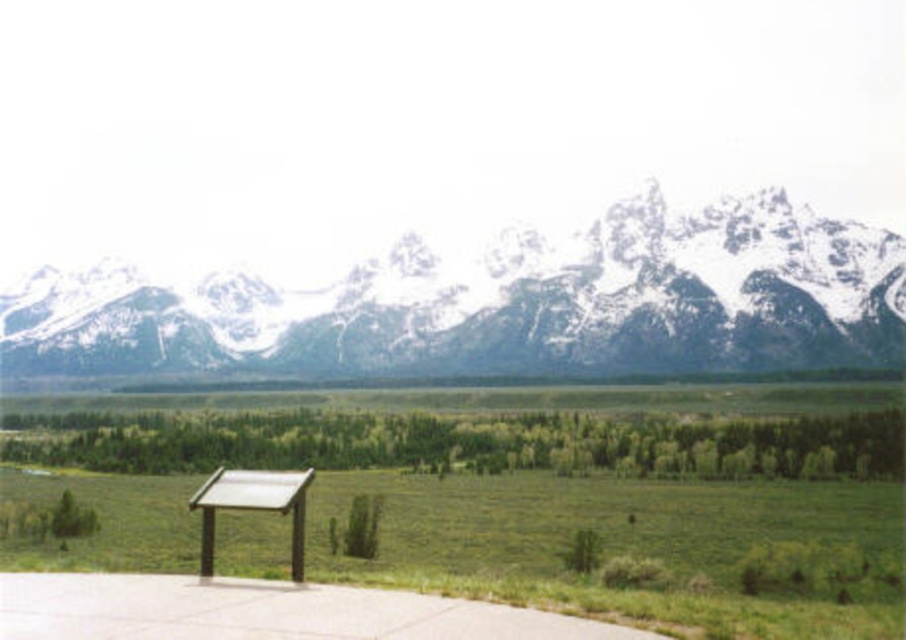
Question: Considering the relative positions of white snow-covered mountain range at upper center and wooden picnic table at lower left in the image provided, where is white snow-covered mountain range at upper center located with respect to wooden picnic table at lower left?

Choices:
 (A) above
 (B) below

Answer: (A)

Question: Is white snow-covered mountain range at upper center bigger than wooden picnic table at lower left?

Choices:
 (A) no
 (B) yes

Answer: (B)

Question: Which point is farther to the camera?

Choices:
 (A) wooden picnic table at lower left
 (B) white snow-covered mountain range at upper center

Answer: (B)

Question: Does white snow-covered mountain range at upper center appear over wooden picnic table at lower left?

Choices:
 (A) yes
 (B) no

Answer: (A)

Question: Which point is farther to the camera?

Choices:
 (A) (200, 538)
 (B) (723, 236)

Answer: (B)